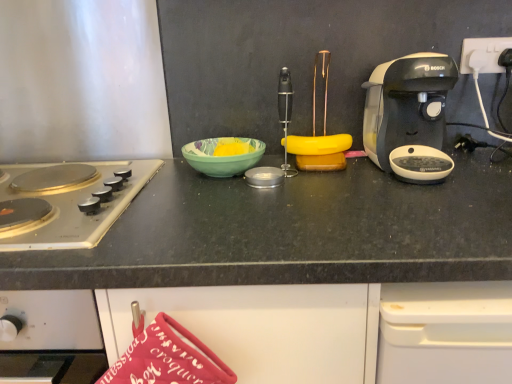
Image resolution: width=512 pixels, height=384 pixels. What are the coordinates of `vacant area located to the right-hand side of green glossy bowl at center` in the screenshot? It's located at (301, 170).